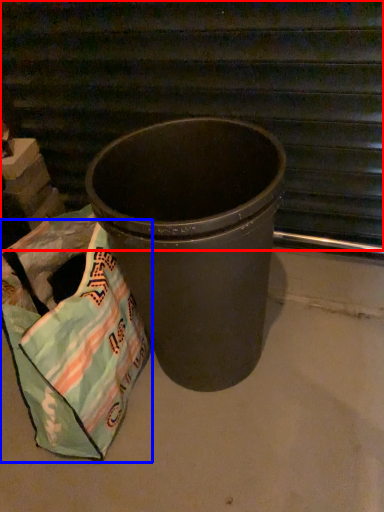
Question: Which object appears closest to the camera in this image, stairwell (highlighted by a red box) or grocery bag (highlighted by a blue box)?

Choices:
 (A) stairwell
 (B) grocery bag

Answer: (B)